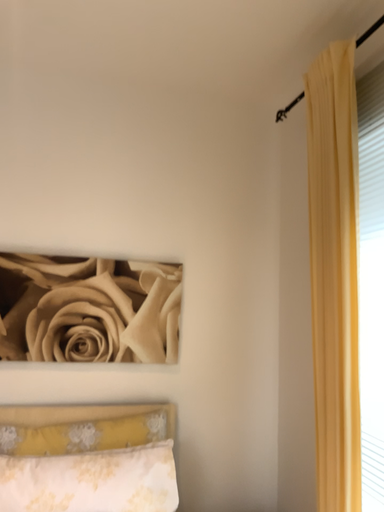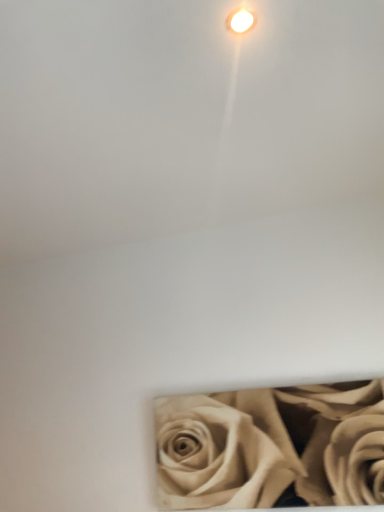
Question: Which way did the camera rotate in the video?

Choices:
 (A) rotated upward
 (B) rotated downward

Answer: (A)